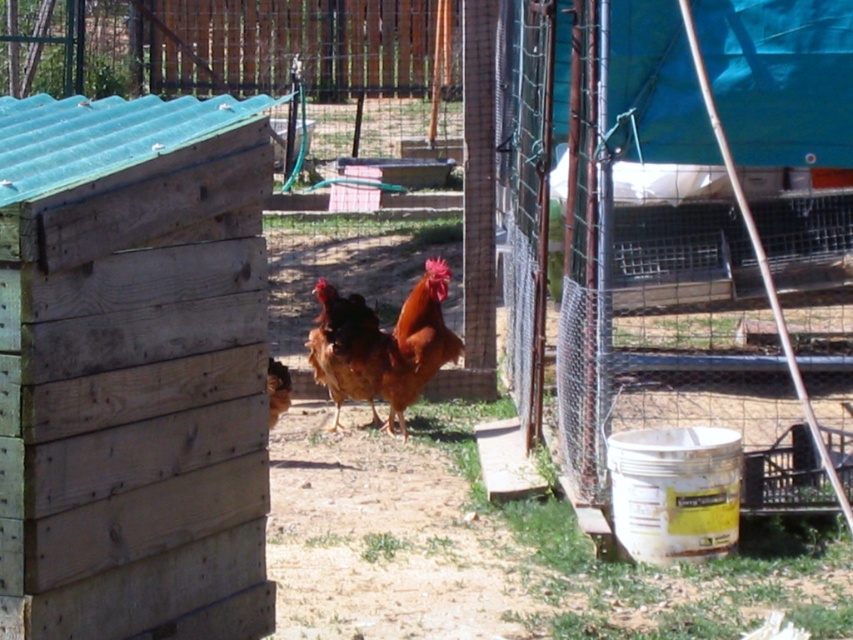
Question: Does brown feathered rooster at center appear on the left side of brown feathered chicken at center?

Choices:
 (A) yes
 (B) no

Answer: (B)

Question: Is brown matte chicken at center bigger than brown feathered chicken at center?

Choices:
 (A) no
 (B) yes

Answer: (B)

Question: Which point is closer to the camera?

Choices:
 (A) (344, 369)
 (B) (289, 378)

Answer: (A)

Question: Does brown matte chicken at center have a smaller size compared to brown feathered rooster at center?

Choices:
 (A) no
 (B) yes

Answer: (A)

Question: Which point is closer to the camera?

Choices:
 (A) (326, 291)
 (B) (346, 340)
 (C) (277, 390)

Answer: (A)

Question: Which of the following is the farthest from the observer?

Choices:
 (A) brown feathered chicken at center
 (B) brown matte chicken at center

Answer: (B)